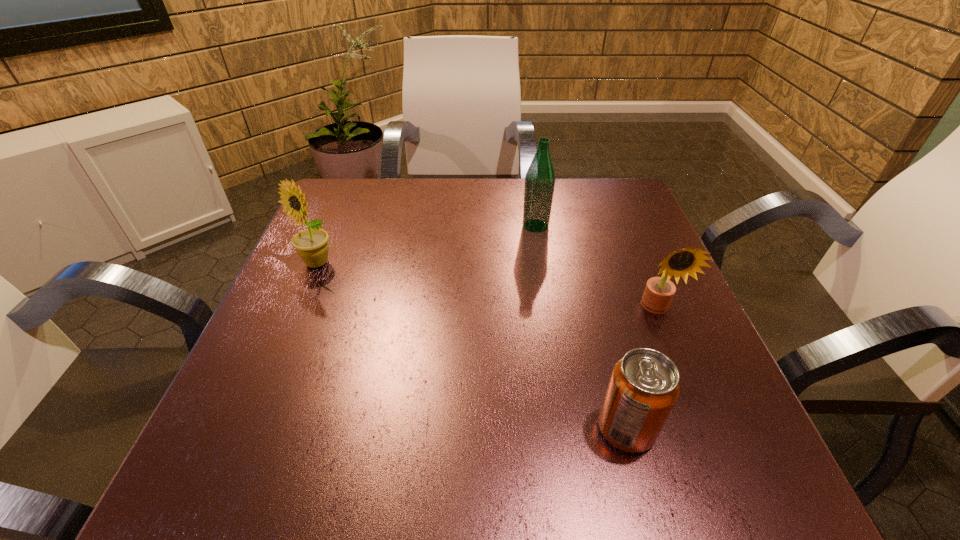
Where is `vacant area that lies between the farther sunflower and the soda can`? This screenshot has width=960, height=540. vacant area that lies between the farther sunflower and the soda can is located at coordinates (471, 346).

You are a GUI agent. You are given a task and a screenshot of the screen. Output one action in this format:
    pyautogui.click(x=<x>, y=<y>)
    Task: Click on the empty space between the nearer sunflower and the bottle
    This screenshot has height=540, width=960.
    Given the screenshot: What is the action you would take?
    pyautogui.click(x=596, y=267)

Find the location of `unoccupied area between the farthest object and the left sunflower`. unoccupied area between the farthest object and the left sunflower is located at coordinates (426, 245).

Identify which object is the second nearest to the farthest object. Please provide its 2D coordinates. Your answer should be formatted as a tuple, i.e. [(x, y)], where the tuple contains the x and y coordinates of a point satisfying the conditions above.

[(312, 246)]

Locate which object is the second closest to the third farthest object. Please provide its 2D coordinates. Your answer should be formatted as a tuple, i.e. [(x, y)], where the tuple contains the x and y coordinates of a point satisfying the conditions above.

[(540, 177)]

Identify the location of vacant region that satisfies the following two spatial constraints: 1. on the face of the left sunflower; 2. on the left side of the third object from left to right. (246, 429).